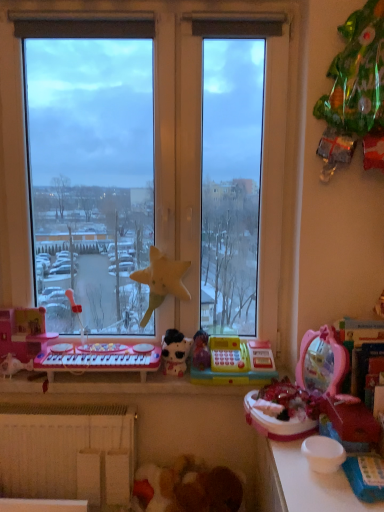
Where is `blue plastic toy at lower right, arranged as the first toy when viewed from the right`? blue plastic toy at lower right, arranged as the first toy when viewed from the right is located at coordinates (365, 477).

What is the approximate width of blue plastic toy at lower right, which is the seventh toy from left to right?

Answer: blue plastic toy at lower right, which is the seventh toy from left to right, is 5.70 inches in width.

Locate an element on the screen. pink plastic musical keyboard at lower left is located at coordinates (99, 359).

The width and height of the screenshot is (384, 512). I want to click on white matte radiator at lower left, so click(x=67, y=451).

The height and width of the screenshot is (512, 384). What do you see at coordinates (21, 338) in the screenshot? I see `pink plastic toy keyboard at left, which is the sixth toy in right-to-left order` at bounding box center [21, 338].

Describe the element at coordinates (282, 411) in the screenshot. This screenshot has width=384, height=512. I see `pink plastic toy at lower right, acting as the 2th toy starting from the right` at that location.

This screenshot has height=512, width=384. Identify the location of yellow fabric star at center, which is the 5th toy from right to left. (162, 280).

Locate an element on the screen. The image size is (384, 512). white glossy plush at center, the 4th toy when ordered from right to left is located at coordinates (175, 352).

In order to click on blue plastic toy at lower right, which is the seventh toy from left to right in this screenshot , I will do `click(365, 477)`.

Considering the relative sizes of transparent glass window at center and yellow plastic cash register at center, which is the third toy in right-to-left order, in the image provided, is transparent glass window at center bigger than yellow plastic cash register at center, which is the third toy in right-to-left order,?

Correct, transparent glass window at center is larger in size than yellow plastic cash register at center, which is the third toy in right-to-left order.

From a real-world perspective, starting from the transparent glass window at center, which toy is the 4th one below it? Please provide its 2D coordinates.

[(236, 362)]

From a real-world perspective, between transparent glass window at center and yellow plastic cash register at center, which is the third toy in right-to-left order, who is vertically higher?

transparent glass window at center is physically above.

From the image's perspective, which is above, transparent glass window at center or yellow plastic cash register at center, which is the third toy in right-to-left order?

transparent glass window at center, from the image's perspective.

From a real-world perspective, which object rests below the other?

In real-world perspective, pink plastic toy at lower right, the sixth toy in the left-to-right sequence, is lower.

Between transparent glass window at center and pink plastic toy at lower right, the sixth toy in the left-to-right sequence, which one is positioned in front?

pink plastic toy at lower right, the sixth toy in the left-to-right sequence, is closer to the camera.

Is transparent glass window at center in contact with pink plastic toy at lower right, acting as the 2th toy starting from the right?

No.

Is pink plastic toy at lower right, acting as the 2th toy starting from the right, inside transparent glass window at center?

No, transparent glass window at center does not contain pink plastic toy at lower right, acting as the 2th toy starting from the right.

Considering their positions, is yellow fabric star at center, which appears as the third toy when viewed from the left, located in front of or behind white matte radiator at lower left?

yellow fabric star at center, which appears as the third toy when viewed from the left, is behind white matte radiator at lower left.

Considering the positions of point (160, 298) and point (109, 464), is point (160, 298) closer or farther from the camera than point (109, 464)?

Point (160, 298) is positioned farther from the camera compared to point (109, 464).

Considering the relative positions of yellow fabric star at center, which appears as the third toy when viewed from the left, and white matte radiator at lower left in the image provided, is yellow fabric star at center, which appears as the third toy when viewed from the left, to the right of white matte radiator at lower left from the viewer's perspective?

Indeed, yellow fabric star at center, which appears as the third toy when viewed from the left, is positioned on the right side of white matte radiator at lower left.

Locate an element on the screen. The width and height of the screenshot is (384, 512). the 2nd toy to the right of the transparent glass window at center, counting from the anchor's position is located at coordinates (175, 352).

Is transparent glass window at center positioned with its back to white glossy plush at center, the fourth toy from the left?

Yes, transparent glass window at center is facing away from white glossy plush at center, the fourth toy from the left.

Based on the photo, what's the angular difference between transparent glass window at center and white glossy plush at center, the 4th toy when ordered from right to left,'s facing directions?

There is a 0.00061-degree angle between the facing directions of transparent glass window at center and white glossy plush at center, the 4th toy when ordered from right to left.

From the image's perspective, which one is positioned lower, transparent glass window at center or white glossy plush at center, the fourth toy from the left?

From the image's view, white glossy plush at center, the fourth toy from the left, is below.

From a real-world perspective, is pink plastic keyboard at lower left, the first toy viewed from the left, above or below yellow fabric star at center, which appears as the third toy when viewed from the left?

pink plastic keyboard at lower left, the first toy viewed from the left, is situated lower than yellow fabric star at center, which appears as the third toy when viewed from the left, in the real world.

How many degrees apart are the facing directions of pink plastic keyboard at lower left, the 7th toy viewed from the right, and yellow fabric star at center, which is the 5th toy from right to left?

They differ by 0.00227 degrees in their facing directions.

In order to click on the 4th toy positioned below the yellow fabric star at center, which appears as the third toy when viewed from the left (from the image's perspective) in this screenshot , I will do `click(13, 365)`.

Is yellow fabric star at center, which appears as the third toy when viewed from the left, at the back of pink plastic keyboard at lower left, the 7th toy viewed from the right?

pink plastic keyboard at lower left, the 7th toy viewed from the right, does not have its back to yellow fabric star at center, which appears as the third toy when viewed from the left.

Which is more to the left, pink plastic toy at lower right, acting as the 2th toy starting from the right, or yellow plastic cash register at center, which is the third toy in right-to-left order?

From the viewer's perspective, yellow plastic cash register at center, which is the third toy in right-to-left order, appears more on the left side.

Consider the image. Considering the sizes of pink plastic toy at lower right, the sixth toy in the left-to-right sequence, and yellow plastic cash register at center, which is counted as the fifth toy, starting from the left, in the image, is pink plastic toy at lower right, the sixth toy in the left-to-right sequence, taller or shorter than yellow plastic cash register at center, which is counted as the fifth toy, starting from the left,?

Considering their sizes, pink plastic toy at lower right, the sixth toy in the left-to-right sequence, has less height than yellow plastic cash register at center, which is counted as the fifth toy, starting from the left.

Between pink plastic toy at lower right, acting as the 2th toy starting from the right, and yellow plastic cash register at center, which is the third toy in right-to-left order, which one has smaller width?

yellow plastic cash register at center, which is the third toy in right-to-left order.

Are pink plastic toy at lower right, acting as the 2th toy starting from the right, and yellow plastic cash register at center, which is the third toy in right-to-left order, located far from each other?

No, there isn't a large distance between pink plastic toy at lower right, acting as the 2th toy starting from the right, and yellow plastic cash register at center, which is the third toy in right-to-left order.

Considering the relative positions of pink plastic musical keyboard at lower left and white matte radiator at lower left in the image provided, is pink plastic musical keyboard at lower left in front of white matte radiator at lower left?

No, pink plastic musical keyboard at lower left is behind white matte radiator at lower left.

Which point is more forward, (131, 364) or (29, 449)?

The point (29, 449) is in front.

What's the angular difference between pink plastic musical keyboard at lower left and white matte radiator at lower left's facing directions?

The angular difference between pink plastic musical keyboard at lower left and white matte radiator at lower left is 2.59 degrees.

Considering the relative positions of pink plastic musical keyboard at lower left and white matte radiator at lower left in the image provided, is pink plastic musical keyboard at lower left to the right of white matte radiator at lower left from the viewer's perspective?

Correct, you'll find pink plastic musical keyboard at lower left to the right of white matte radiator at lower left.

Locate an element on the screen. toy that is the 4th object directly below the transparent glass window at center (from a real-world perspective) is located at coordinates (236, 362).

This screenshot has height=512, width=384. Identify the location of window behind the pink plastic toy at lower right, the sixth toy in the left-to-right sequence. (176, 156).

Considering their positions, is pink plastic toy at lower right, the sixth toy in the left-to-right sequence, positioned closer to white matte radiator at lower left than pink plastic keyboard at lower left, the 7th toy viewed from the right?

The object closer to white matte radiator at lower left is pink plastic keyboard at lower left, the 7th toy viewed from the right.

When comparing their distances from pink plastic keyboard at lower left, the 7th toy viewed from the right, does yellow plastic cash register at center, which is counted as the fifth toy, starting from the left, or pink plastic toy keyboard at left, which is the sixth toy in right-to-left order, seem further?

Among the two, yellow plastic cash register at center, which is counted as the fifth toy, starting from the left, is located further to pink plastic keyboard at lower left, the 7th toy viewed from the right.

Looking at the image, which one is located closer to pink plastic toy at lower right, acting as the 2th toy starting from the right, pink plastic toy keyboard at left, acting as the second toy starting from the left, or pink plastic musical keyboard at lower left?

pink plastic musical keyboard at lower left lies closer to pink plastic toy at lower right, acting as the 2th toy starting from the right, than the other object.

Based on their spatial positions, is pink plastic toy keyboard at left, acting as the second toy starting from the left, or yellow plastic cash register at center, which is counted as the fifth toy, starting from the left, closer to yellow fabric star at center, which is the 5th toy from right to left?

Based on the image, yellow plastic cash register at center, which is counted as the fifth toy, starting from the left, appears to be nearer to yellow fabric star at center, which is the 5th toy from right to left.

When comparing their distances from yellow fabric star at center, which appears as the third toy when viewed from the left, does blue plastic toy at lower right, which is the seventh toy from left to right, or pink plastic keyboard at lower left, the first toy viewed from the left, seem further?

blue plastic toy at lower right, which is the seventh toy from left to right, lies further to yellow fabric star at center, which appears as the third toy when viewed from the left, than the other object.

Which object lies further to the anchor point pink plastic musical keyboard at lower left, white matte radiator at lower left or white glossy plush at center, the fourth toy from the left?

white matte radiator at lower left is further to pink plastic musical keyboard at lower left.

Estimate the real-world distances between objects in this image. Which object is closer to pink plastic toy keyboard at left, which is the sixth toy in right-to-left order, pink plastic musical keyboard at lower left or pink plastic toy at lower right, the sixth toy in the left-to-right sequence?

pink plastic musical keyboard at lower left lies closer to pink plastic toy keyboard at left, which is the sixth toy in right-to-left order, than the other object.

Considering their positions, is transparent glass window at center positioned further to pink plastic keyboard at lower left, the first toy viewed from the left, than white matte radiator at lower left?

transparent glass window at center is positioned further to the anchor pink plastic keyboard at lower left, the first toy viewed from the left.

Where is `musical keyboard situated between white matte radiator at lower left and pink plastic toy at lower right, the sixth toy in the left-to-right sequence, from left to right`? This screenshot has height=512, width=384. musical keyboard situated between white matte radiator at lower left and pink plastic toy at lower right, the sixth toy in the left-to-right sequence, from left to right is located at coordinates (99, 359).

The width and height of the screenshot is (384, 512). In order to click on radiator located between pink plastic toy keyboard at left, which is the sixth toy in right-to-left order, and yellow plastic cash register at center, which is the third toy in right-to-left order, in the left-right direction in this screenshot , I will do `click(67, 451)`.

Identify the location of musical keyboard between pink plastic toy keyboard at left, acting as the second toy starting from the left, and white glossy plush at center, the 4th toy when ordered from right to left. (99, 359).

This screenshot has width=384, height=512. I want to click on musical keyboard between pink plastic toy keyboard at left, which is the sixth toy in right-to-left order, and pink plastic toy at lower right, acting as the 2th toy starting from the right, from left to right, so click(99, 359).